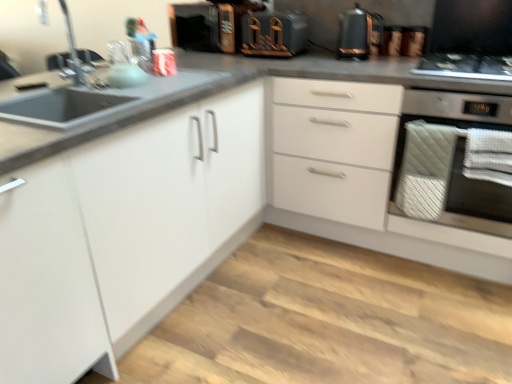
Question: From the image's perspective, is black glass gas stove at upper right on matte silver faucet at upper left?

Choices:
 (A) no
 (B) yes

Answer: (B)

Question: Considering the relative sizes of black glass gas stove at upper right and matte silver faucet at upper left in the image provided, is black glass gas stove at upper right taller than matte silver faucet at upper left?

Choices:
 (A) yes
 (B) no

Answer: (B)

Question: From a real-world perspective, is black glass gas stove at upper right physically below matte silver faucet at upper left?

Choices:
 (A) no
 (B) yes

Answer: (B)

Question: From a real-world perspective, is black glass gas stove at upper right on matte silver faucet at upper left?

Choices:
 (A) yes
 (B) no

Answer: (B)

Question: Could matte silver faucet at upper left be considered to be inside black glass gas stove at upper right?

Choices:
 (A) yes
 (B) no

Answer: (B)

Question: Is black glass gas stove at upper right further to camera compared to matte silver faucet at upper left?

Choices:
 (A) yes
 (B) no

Answer: (A)

Question: Is black glass gas stove at upper right next to white matte cabinet at center?

Choices:
 (A) yes
 (B) no

Answer: (B)

Question: Does black glass gas stove at upper right have a larger size compared to white matte cabinet at center?

Choices:
 (A) yes
 (B) no

Answer: (B)

Question: Is black glass gas stove at upper right closer to the viewer compared to white matte cabinet at center?

Choices:
 (A) no
 (B) yes

Answer: (A)

Question: Can you confirm if black glass gas stove at upper right is wider than white matte cabinet at center?

Choices:
 (A) yes
 (B) no

Answer: (B)

Question: Does black glass gas stove at upper right have a lesser width compared to white matte cabinet at center?

Choices:
 (A) no
 (B) yes

Answer: (B)

Question: Is black glass gas stove at upper right outside white matte cabinet at center?

Choices:
 (A) yes
 (B) no

Answer: (A)

Question: From the image's perspective, would you say white quilted towel at right is positioned over white matte cabinet at center?

Choices:
 (A) no
 (B) yes

Answer: (B)